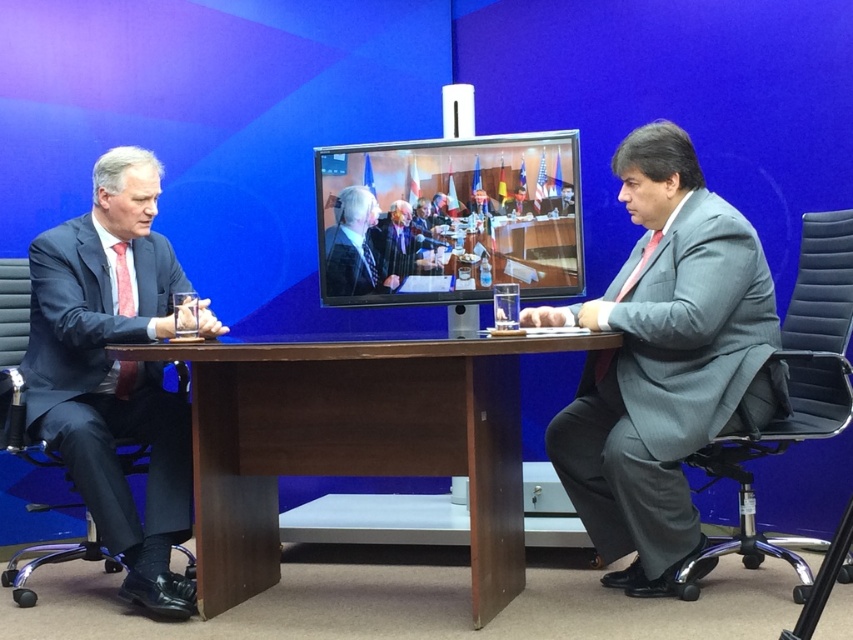
Based on the photo, you are a delivery person who needs to place a 20 inch box between the brown wood table at center and the gray textured suit at right. Can you fit it there?

The distance between the brown wood table at center and the gray textured suit at right is 19.94 inches, which is slightly shorter than the 20 inch box. Therefore, the box cannot be placed there without overlapping the existing objects.

You are a photographer setting up a shoot in the studio. You need to position a large camera on the floor so that it can capture both the brown wood table at center and the gray textured suit at right clearly. Based on their positions, where should you place the camera relative to these objects?

The brown wood table at center is located below the gray textured suit at right, so placing the camera at an elevated position facing downward would allow it to capture both objects clearly.